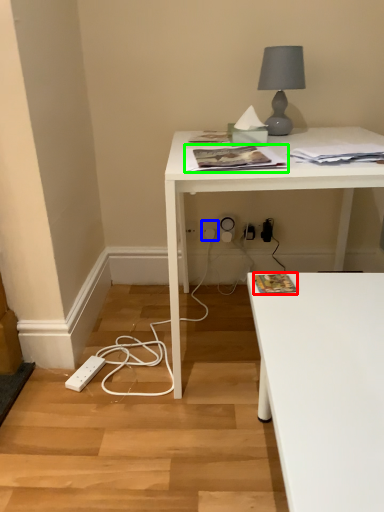
Question: Estimate the real-world distances between objects in this image. Which object is closer to magazine (highlighted by a red box), electric outlet (highlighted by a blue box) or magazine (highlighted by a green box)?

Choices:
 (A) electric outlet
 (B) magazine

Answer: (B)